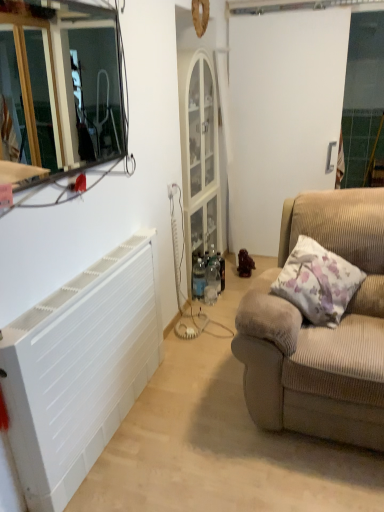
Question: Does brown matte figurine at center-right come behind beige corduroy couch at right?

Choices:
 (A) no
 (B) yes

Answer: (B)

Question: Does brown matte figurine at center-right come in front of beige corduroy couch at right?

Choices:
 (A) no
 (B) yes

Answer: (A)

Question: Does brown matte figurine at center-right have a lesser height compared to beige corduroy couch at right?

Choices:
 (A) yes
 (B) no

Answer: (A)

Question: From a real-world perspective, is brown matte figurine at center-right on beige corduroy couch at right?

Choices:
 (A) yes
 (B) no

Answer: (B)

Question: Is brown matte figurine at center-right wider than beige corduroy couch at right?

Choices:
 (A) yes
 (B) no

Answer: (B)

Question: Relative to fluffy beige pillow at right, is white matte door at center in front or behind?

Choices:
 (A) front
 (B) behind

Answer: (B)

Question: From the image's perspective, is white matte door at center above or below fluffy beige pillow at right?

Choices:
 (A) below
 (B) above

Answer: (B)

Question: Is white matte door at center wider or thinner than fluffy beige pillow at right?

Choices:
 (A) thin
 (B) wide

Answer: (A)

Question: Is white matte door at center taller or shorter than fluffy beige pillow at right?

Choices:
 (A) tall
 (B) short

Answer: (A)

Question: From the image's perspective, is white plastic radiator at left located above or below beige corduroy couch at right?

Choices:
 (A) above
 (B) below

Answer: (B)

Question: Based on their sizes in the image, would you say white plastic radiator at left is bigger or smaller than beige corduroy couch at right?

Choices:
 (A) small
 (B) big

Answer: (A)

Question: In the image, is white plastic radiator at left on the left side or the right side of beige corduroy couch at right?

Choices:
 (A) right
 (B) left

Answer: (B)

Question: In the image, is white plastic radiator at left positioned in front of or behind beige corduroy couch at right?

Choices:
 (A) behind
 (B) front

Answer: (B)

Question: Considering the relative positions of fluffy beige pillow at right and beige corduroy couch at right in the image provided, is fluffy beige pillow at right to the left or to the right of beige corduroy couch at right?

Choices:
 (A) right
 (B) left

Answer: (B)

Question: Is fluffy beige pillow at right bigger or smaller than beige corduroy couch at right?

Choices:
 (A) big
 (B) small

Answer: (B)